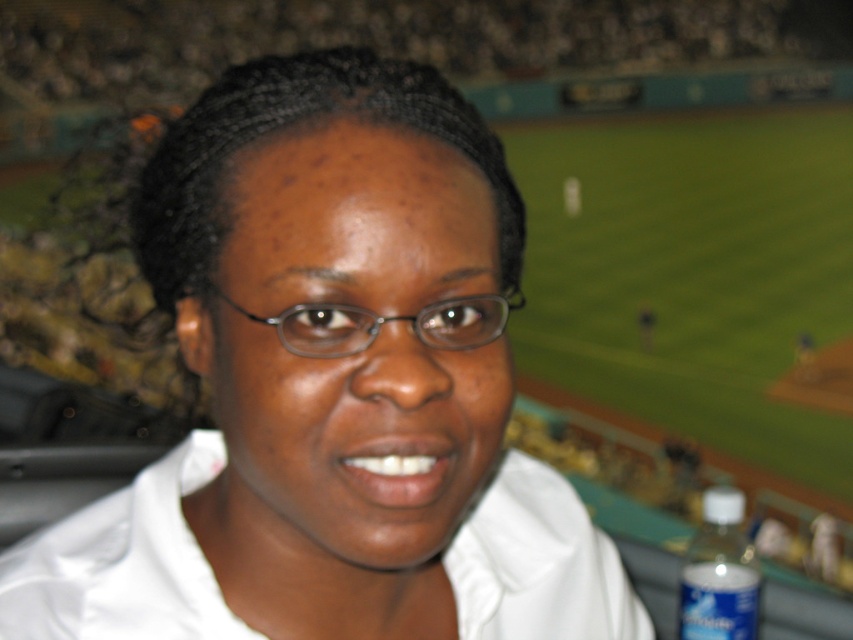
You are sitting in the stadium and want to look at two points in the image. The first point is point (x=30, y=540) and the second is point (x=579, y=598). Which point is closer to you?

Point (x=30, y=540) is in front of point (x=579, y=598), so it is closer to you.

You are a photographer trying to capture a candid shot of the person in the white matte shirt at center without including the blue plastic bottle at lower right. Based on their relative sizes, can you frame the shot so the shirt is visible but the bottle is cropped out?

The white matte shirt at center is wider than the blue plastic bottle at lower right. Since the shirt is wider, you can frame the shot focusing on the shirt while positioning the bottle at the edge or outside the frame to exclude it.